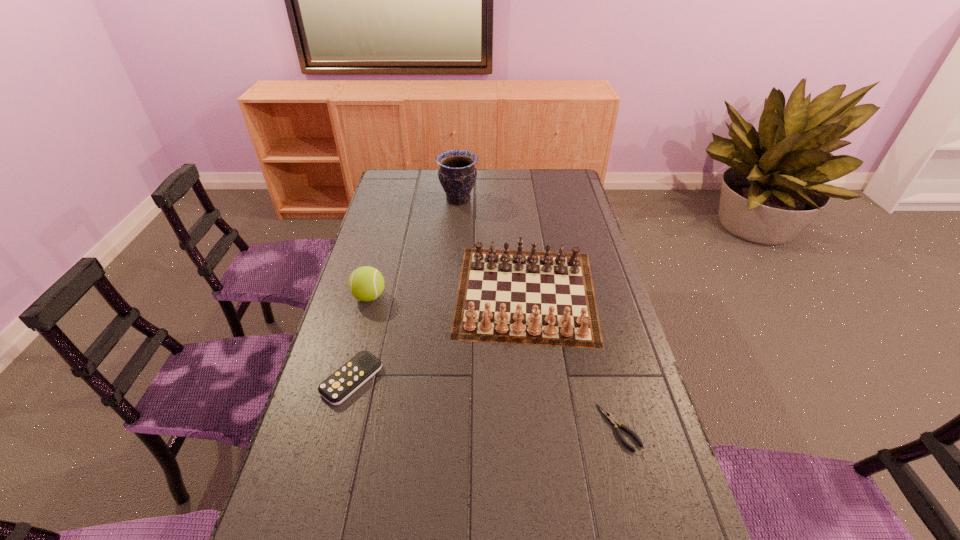
Locate an element on the screen. pottery is located at coordinates (457, 174).

Find the location of a particular element. the tallest object is located at coordinates (457, 174).

Identify the location of tennis ball. (366, 283).

You are a GUI agent. You are given a task and a screenshot of the screen. Output one action in this format:
    pyautogui.click(x=<x>, y=<y>)
    Task: Click on the chessboard
    
    Given the screenshot: What is the action you would take?
    pyautogui.click(x=540, y=299)

In order to click on the fourth tallest object in this screenshot , I will do `click(352, 375)`.

The image size is (960, 540). In order to click on the shortest object in this screenshot , I will do `click(613, 421)`.

Locate an element on the screen. Image resolution: width=960 pixels, height=540 pixels. blank space located 0.190m on the front handle of the tallest object is located at coordinates (521, 200).

The image size is (960, 540). Find the location of `free space located 0.060m on the back of the tennis ball`. free space located 0.060m on the back of the tennis ball is located at coordinates (375, 274).

At what (x,y) coordinates should I click in order to perform the action: click on vacant space situated 0.080m on the left of the chessboard. Please return your answer as a coordinate pair (x, y). Image resolution: width=960 pixels, height=540 pixels. Looking at the image, I should click on coord(429,292).

In order to click on free space located on the back of the remote control in this screenshot , I will do `click(376, 284)`.